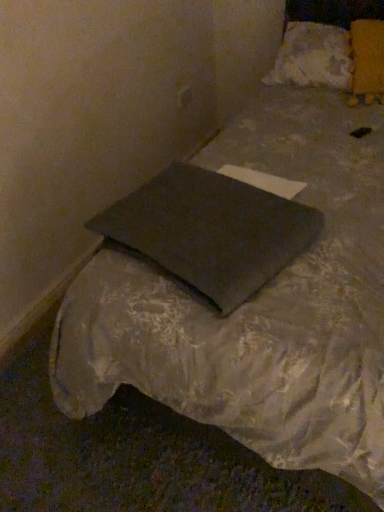
Question: Is dark gray fabric pillow at center, positioned as the third pillow in top-to-bottom order, to the right of white fluffy pillow at upper right, marked as the first pillow in a back-to-front arrangement, from the viewer's perspective?

Choices:
 (A) no
 (B) yes

Answer: (A)

Question: Does dark gray fabric pillow at center, positioned as the third pillow in top-to-bottom order, have a lesser height compared to white fluffy pillow at upper right, which is the third pillow in bottom-to-top order?

Choices:
 (A) no
 (B) yes

Answer: (B)

Question: From the image's perspective, is dark gray fabric pillow at center, positioned as the third pillow in top-to-bottom order, beneath white fluffy pillow at upper right, which is the third pillow in bottom-to-top order?

Choices:
 (A) no
 (B) yes

Answer: (B)

Question: From a real-world perspective, is dark gray fabric pillow at center, which is the first pillow from bottom to top, positioned over white fluffy pillow at upper right, which appears as the 3th pillow when viewed from the front, based on gravity?

Choices:
 (A) no
 (B) yes

Answer: (A)

Question: Can we say dark gray fabric pillow at center, marked as the 3th pillow in a back-to-front arrangement, lies outside white fluffy pillow at upper right, which appears as the 3th pillow when viewed from the front?

Choices:
 (A) yes
 (B) no

Answer: (A)

Question: Are dark gray fabric pillow at center, which is the first pillow from bottom to top, and white fluffy pillow at upper right, marked as the first pillow in a back-to-front arrangement, making contact?

Choices:
 (A) yes
 (B) no

Answer: (B)

Question: Is yellow fabric pillow at upper right, which is counted as the 2th pillow, starting from the top, behind dark gray fabric pillow at center, marked as the 3th pillow in a back-to-front arrangement?

Choices:
 (A) yes
 (B) no

Answer: (A)

Question: Can dark gray fabric pillow at center, which is the first pillow from bottom to top, be found inside yellow fabric pillow at upper right, which is counted as the 2th pillow, starting from the top?

Choices:
 (A) no
 (B) yes

Answer: (A)

Question: Is yellow fabric pillow at upper right, which is the 2th pillow from bottom to top, to the right of dark gray fabric pillow at center, marked as the 1th pillow in a front-to-back arrangement, from the viewer's perspective?

Choices:
 (A) yes
 (B) no

Answer: (A)

Question: Does yellow fabric pillow at upper right, arranged as the 2th pillow when viewed from the front, have a greater width compared to dark gray fabric pillow at center, marked as the 3th pillow in a back-to-front arrangement?

Choices:
 (A) no
 (B) yes

Answer: (A)

Question: Is the surface of yellow fabric pillow at upper right, which is counted as the 2th pillow, starting from the top, in direct contact with dark gray fabric pillow at center, marked as the 1th pillow in a front-to-back arrangement?

Choices:
 (A) yes
 (B) no

Answer: (B)

Question: From the image's perspective, would you say yellow fabric pillow at upper right, which is counted as the 2th pillow, starting from the top, is positioned over dark gray fabric pillow at center, which is the first pillow from bottom to top?

Choices:
 (A) no
 (B) yes

Answer: (B)

Question: From the image's perspective, is dark gray fabric pillow at center, marked as the 1th pillow in a front-to-back arrangement, below yellow fabric pillow at upper right, acting as the second pillow starting from the back?

Choices:
 (A) no
 (B) yes

Answer: (B)